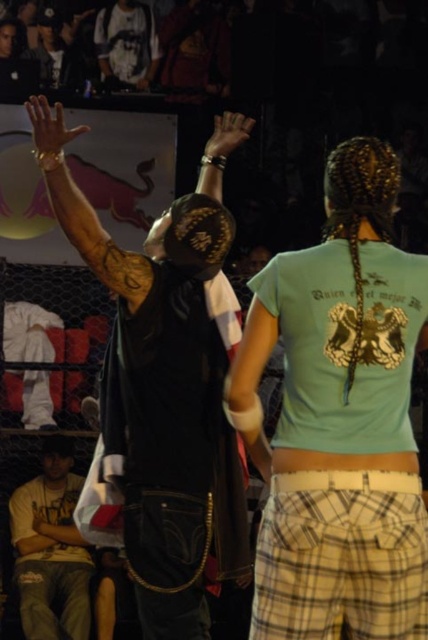
Question: Which point appears farthest from the camera in this image?

Choices:
 (A) (183, 259)
 (B) (33, 593)

Answer: (B)

Question: In this image, where is dark skin tattooed arm at upper left located relative to matte black hand at upper center?

Choices:
 (A) below
 (B) above

Answer: (A)

Question: Which point appears closest to the camera in this image?

Choices:
 (A) (238, 145)
 (B) (217, 172)
 (C) (56, 445)

Answer: (B)

Question: Can you confirm if white fabric shirt at upper center is positioned to the left of smooth white hand at center?

Choices:
 (A) yes
 (B) no

Answer: (B)

Question: Is black leather jacket at center closer to the viewer compared to white fabric shirt at upper center?

Choices:
 (A) yes
 (B) no

Answer: (A)

Question: Which point is closer to the camera?

Choices:
 (A) (42, 524)
 (B) (145, 20)
 (C) (47, 154)
 (D) (56, 637)

Answer: (C)